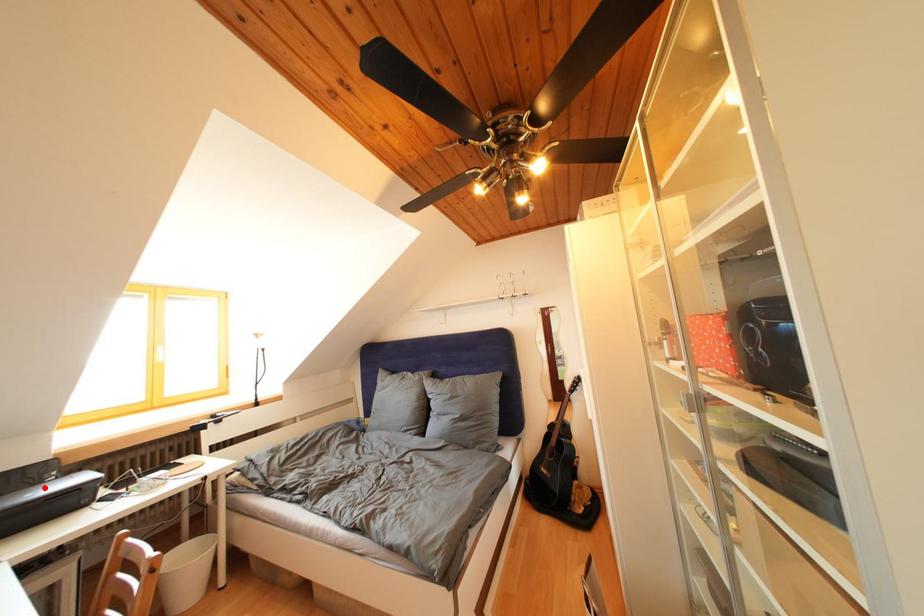
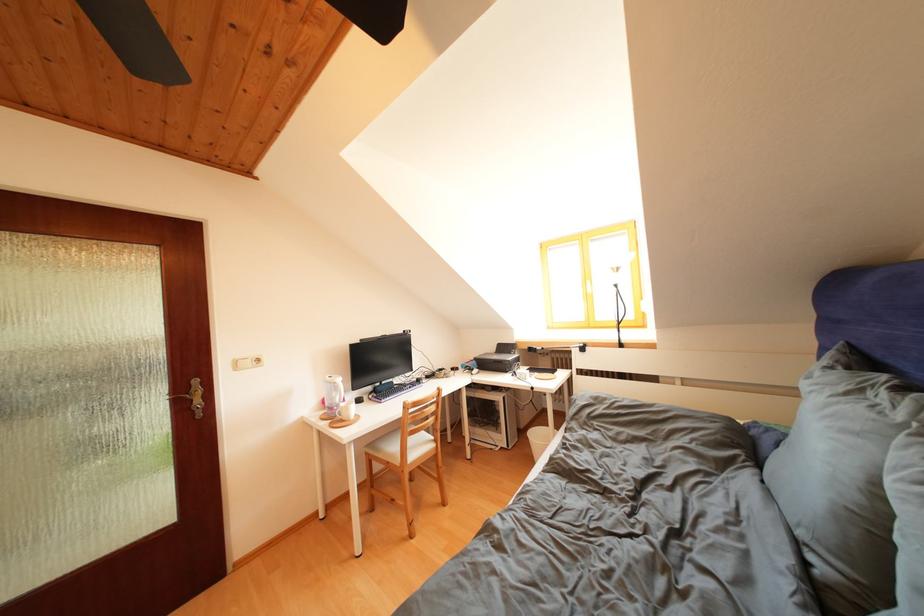
In the second image, find the point that corresponds to the highlighted location in the first image.

(517, 358)